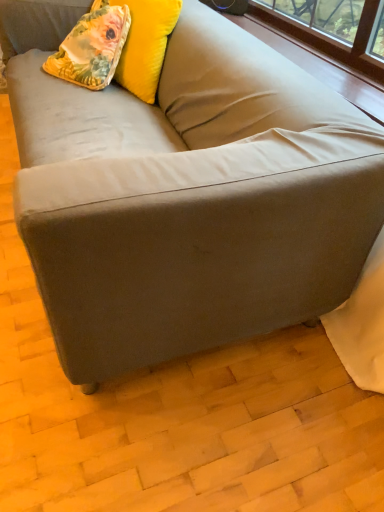
Question: Is floral fabric pillow at upper left thinner than floral fabric pillow at upper left?

Choices:
 (A) yes
 (B) no

Answer: (A)

Question: Are floral fabric pillow at upper left and floral fabric pillow at upper left beside each other?

Choices:
 (A) no
 (B) yes

Answer: (A)

Question: Can you confirm if floral fabric pillow at upper left is bigger than floral fabric pillow at upper left?

Choices:
 (A) yes
 (B) no

Answer: (A)

Question: From the image's perspective, does floral fabric pillow at upper left appear lower than floral fabric pillow at upper left?

Choices:
 (A) yes
 (B) no

Answer: (B)

Question: Does floral fabric pillow at upper left have a greater width compared to floral fabric pillow at upper left?

Choices:
 (A) yes
 (B) no

Answer: (B)

Question: Is the depth of floral fabric pillow at upper left greater than that of floral fabric pillow at upper left?

Choices:
 (A) yes
 (B) no

Answer: (B)

Question: Can you confirm if floral fabric pillow at upper left is positioned to the left of floral fabric pillow at upper left?

Choices:
 (A) yes
 (B) no

Answer: (A)

Question: From the image's perspective, is floral fabric pillow at upper left beneath floral fabric pillow at upper left?

Choices:
 (A) yes
 (B) no

Answer: (A)

Question: Would you say floral fabric pillow at upper left contains floral fabric pillow at upper left?

Choices:
 (A) no
 (B) yes

Answer: (A)

Question: Is floral fabric pillow at upper left oriented away from floral fabric pillow at upper left?

Choices:
 (A) yes
 (B) no

Answer: (A)

Question: Does floral fabric pillow at upper left have a lesser width compared to floral fabric pillow at upper left?

Choices:
 (A) yes
 (B) no

Answer: (B)

Question: Is floral fabric pillow at upper left oriented towards floral fabric pillow at upper left?

Choices:
 (A) no
 (B) yes

Answer: (B)

Question: Is floral fabric pillow at upper left to the left or to the right of floral fabric pillow at upper left in the image?

Choices:
 (A) left
 (B) right

Answer: (B)